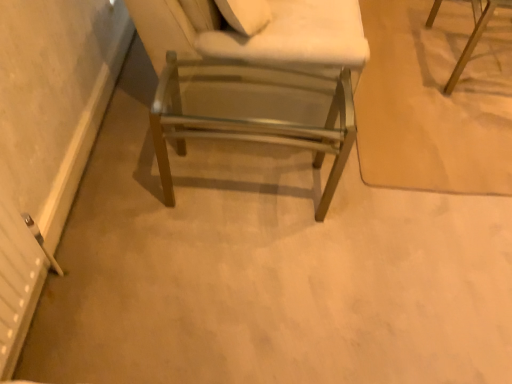
Question: Considering the relative positions of metallic silver chair at center, the first chair in the front-to-back sequence, and wooden chair at upper right, the first chair viewed from the right, in the image provided, is metallic silver chair at center, the first chair in the front-to-back sequence, to the left of wooden chair at upper right, the first chair viewed from the right, from the viewer's perspective?

Choices:
 (A) yes
 (B) no

Answer: (A)

Question: Is metallic silver chair at center, positioned as the second chair in right-to-left order, positioned with its back to wooden chair at upper right, the first chair viewed from the right?

Choices:
 (A) no
 (B) yes

Answer: (A)

Question: From a real-world perspective, does metallic silver chair at center, marked as the first chair in a left-to-right arrangement, stand above wooden chair at upper right, the first chair viewed from the right?

Choices:
 (A) no
 (B) yes

Answer: (A)

Question: Is metallic silver chair at center, positioned as the second chair in right-to-left order, in front of wooden chair at upper right, the 1th chair positioned from the back?

Choices:
 (A) no
 (B) yes

Answer: (B)

Question: Does metallic silver chair at center, placed as the second chair when sorted from back to front, have a greater width compared to wooden chair at upper right, placed as the second chair when sorted from front to back?

Choices:
 (A) yes
 (B) no

Answer: (A)

Question: Could wooden chair at upper right, the first chair viewed from the right, be considered to be inside metallic silver chair at center, placed as the second chair when sorted from back to front?

Choices:
 (A) no
 (B) yes

Answer: (A)

Question: From a real-world perspective, is wooden chair at upper right, placed as the second chair when sorted from front to back, positioned under metallic silver chair at center, positioned as the second chair in right-to-left order, based on gravity?

Choices:
 (A) no
 (B) yes

Answer: (A)

Question: Is wooden chair at upper right, which is the 1th chair in top-to-bottom order, to the right of metallic silver chair at center, which is counted as the 1th chair, starting from the bottom, from the viewer's perspective?

Choices:
 (A) no
 (B) yes

Answer: (B)

Question: From a real-world perspective, is wooden chair at upper right, the 1th chair positioned from the back, over metallic silver chair at center, which is counted as the 1th chair, starting from the bottom?

Choices:
 (A) no
 (B) yes

Answer: (B)

Question: Is wooden chair at upper right, the first chair viewed from the right, facing towards metallic silver chair at center, marked as the first chair in a left-to-right arrangement?

Choices:
 (A) no
 (B) yes

Answer: (A)

Question: Is wooden chair at upper right, the second chair ordered from the bottom, to the left of metallic silver chair at center, marked as the first chair in a left-to-right arrangement, from the viewer's perspective?

Choices:
 (A) no
 (B) yes

Answer: (A)

Question: Can metallic silver chair at center, marked as the first chair in a left-to-right arrangement, be found inside wooden chair at upper right, the 2th chair in the left-to-right sequence?

Choices:
 (A) no
 (B) yes

Answer: (A)

Question: Looking at their shapes, would you say wooden chair at upper right, which is the 1th chair in top-to-bottom order, is wider or thinner than metallic silver chair at center, positioned as the second chair in right-to-left order?

Choices:
 (A) wide
 (B) thin

Answer: (B)